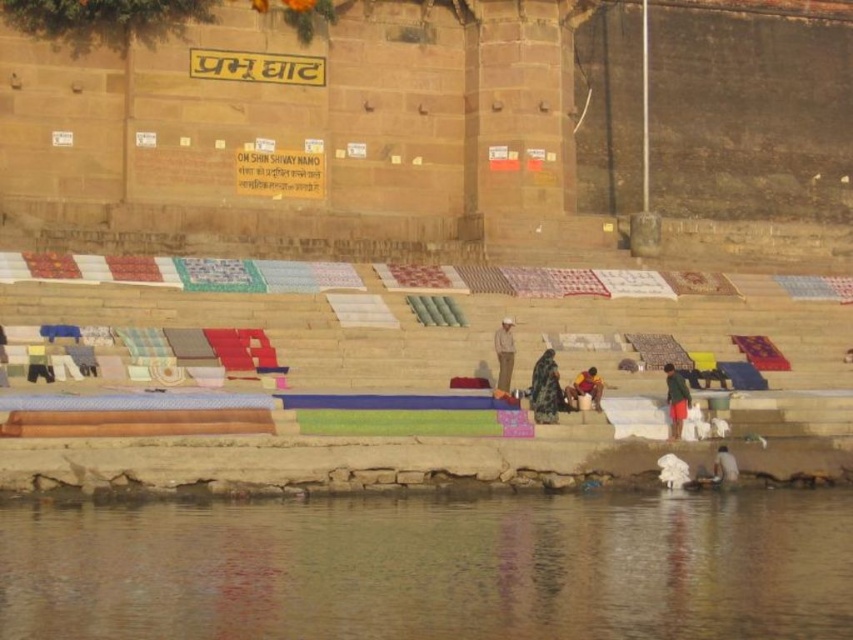
Question: Can you confirm if light brown fabric at center is bigger than dark blue fabric at center?

Choices:
 (A) yes
 (B) no

Answer: (A)

Question: Is brown water at lower center to the left of dark blue fabric at lower right from the viewer's perspective?

Choices:
 (A) no
 (B) yes

Answer: (B)

Question: Estimate the real-world distances between objects in this image. Which object is closer to the dark green fabric at center?

Choices:
 (A) brown water at lower center
 (B) green fabric at center
 (C) dark blue fabric at center
 (D) light brown fabric at center

Answer: (C)

Question: Does brown water at lower center appear over dark blue fabric at center?

Choices:
 (A) yes
 (B) no

Answer: (B)

Question: Which point is closer to the camera?

Choices:
 (A) (590, 388)
 (B) (149, 520)
 (C) (502, 348)
 (D) (666, 365)

Answer: (B)

Question: Which of the following is the closest to the observer?

Choices:
 (A) (576, 397)
 (B) (537, 413)
 (C) (164, 508)

Answer: (C)